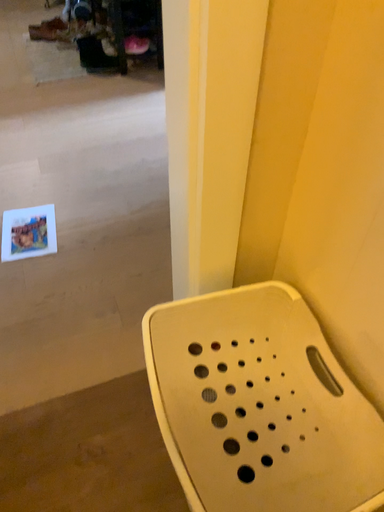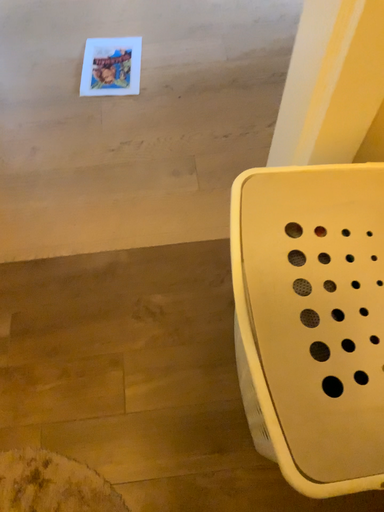
Question: How did the camera likely rotate when shooting the video?

Choices:
 (A) rotated upward
 (B) rotated downward

Answer: (B)